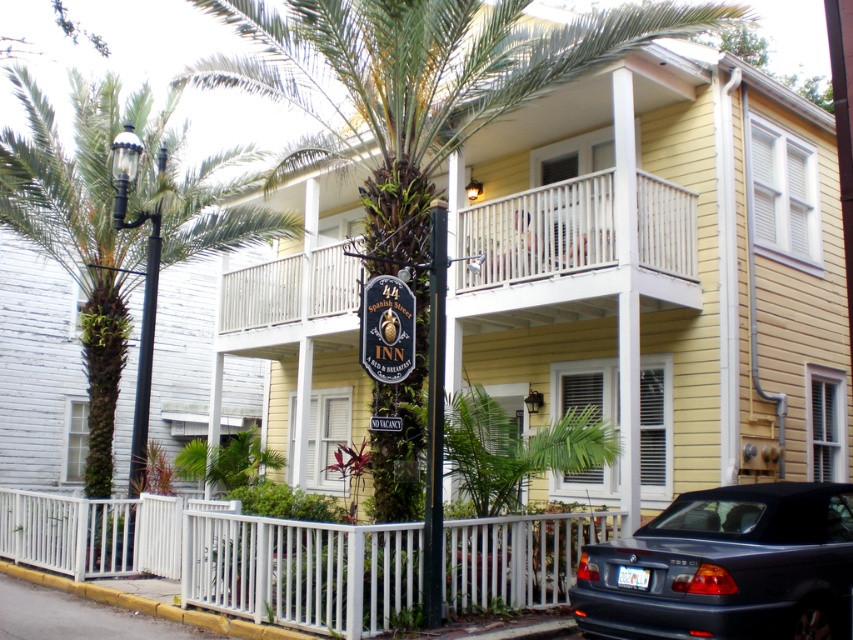
Question: Is white wooden fence at lower center further to the viewer compared to shiny dark blue convertible at lower right?

Choices:
 (A) yes
 (B) no

Answer: (A)

Question: Based on their relative distances, which object is farther from the black metal streetlight at left?

Choices:
 (A) shiny dark blue convertible at lower right
 (B) white wooden balcony at upper center

Answer: (A)

Question: Which of the following is the farthest from the observer?

Choices:
 (A) black metal pole at center
 (B) white wooden fence at lower center
 (C) shiny dark blue convertible at lower right

Answer: (B)

Question: Does green leafy palm tree at left have a lesser width compared to black metal pole at center?

Choices:
 (A) no
 (B) yes

Answer: (A)

Question: Which object is farther from the camera taking this photo?

Choices:
 (A) white wooden fence at lower center
 (B) shiny dark blue convertible at lower right

Answer: (A)

Question: Does green leafy palm tree at left have a greater width compared to black metal streetlight at left?

Choices:
 (A) no
 (B) yes

Answer: (B)